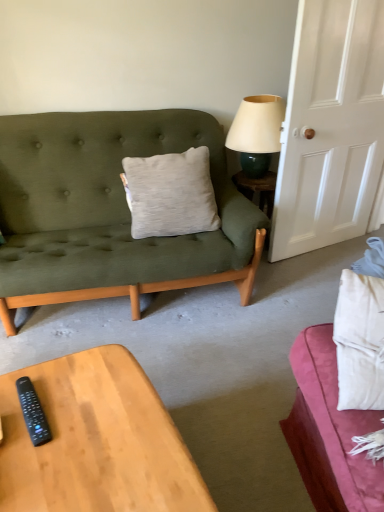
Question: Is wooden coffee table at lower left not inside black plastic remote at lower left?

Choices:
 (A) yes
 (B) no

Answer: (A)

Question: Does wooden coffee table at lower left have a larger size compared to black plastic remote at lower left?

Choices:
 (A) no
 (B) yes

Answer: (B)

Question: From a real-world perspective, is wooden coffee table at lower left located beneath black plastic remote at lower left?

Choices:
 (A) yes
 (B) no

Answer: (A)

Question: Considering the relative sizes of wooden coffee table at lower left and black plastic remote at lower left in the image provided, is wooden coffee table at lower left wider than black plastic remote at lower left?

Choices:
 (A) no
 (B) yes

Answer: (B)

Question: Is wooden coffee table at lower left closer to the viewer compared to black plastic remote at lower left?

Choices:
 (A) no
 (B) yes

Answer: (B)

Question: Could you tell me if wooden coffee table at lower left is turned towards black plastic remote at lower left?

Choices:
 (A) no
 (B) yes

Answer: (A)

Question: Does black plastic remote at lower left appear on the right side of wooden coffee table at lower left?

Choices:
 (A) yes
 (B) no

Answer: (B)

Question: Is black plastic remote at lower left thinner than wooden coffee table at lower left?

Choices:
 (A) yes
 (B) no

Answer: (A)

Question: From a real-world perspective, is black plastic remote at lower left over wooden coffee table at lower left?

Choices:
 (A) yes
 (B) no

Answer: (A)

Question: Can we say black plastic remote at lower left lies outside wooden coffee table at lower left?

Choices:
 (A) yes
 (B) no

Answer: (A)

Question: Considering the relative positions of black plastic remote at lower left and wooden coffee table at lower left in the image provided, is black plastic remote at lower left to the left of wooden coffee table at lower left from the viewer's perspective?

Choices:
 (A) no
 (B) yes

Answer: (B)

Question: Can you confirm if black plastic remote at lower left is wider than wooden coffee table at lower left?

Choices:
 (A) no
 (B) yes

Answer: (A)

Question: Is the position of white matte door at right more distant than that of black plastic remote at lower left?

Choices:
 (A) no
 (B) yes

Answer: (B)